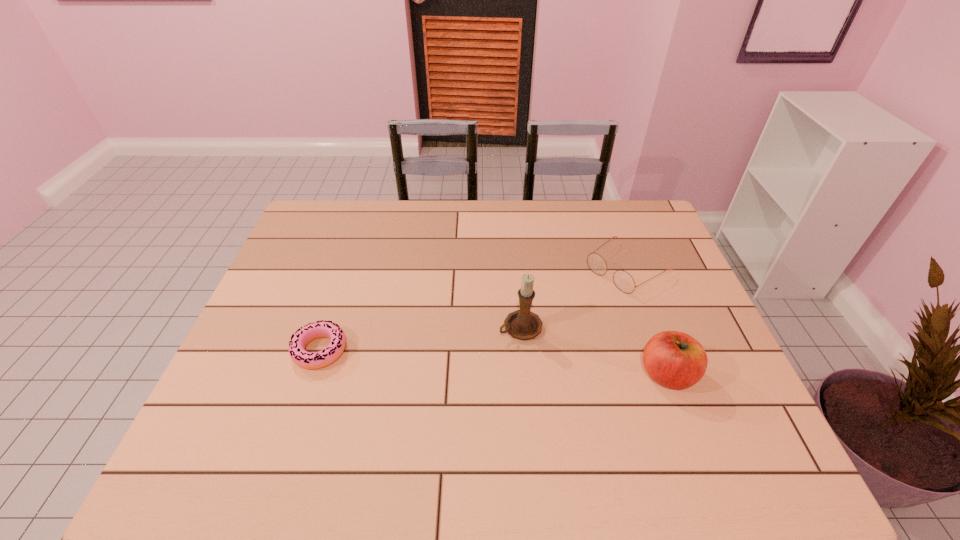
Identify the location of blank area located on the temples of the spectacles. The width and height of the screenshot is (960, 540). (567, 309).

This screenshot has width=960, height=540. What are the coordinates of `free space located on the temples of the spectacles` in the screenshot? It's located at (567, 309).

I want to click on vacant space situated on the side of the second object from left to right with the handle, so click(485, 342).

You are a GUI agent. You are given a task and a screenshot of the screen. Output one action in this format:
    pyautogui.click(x=<x>, y=<y>)
    Task: Click on the blank space located on the side of the second object from left to right with the handle
    
    Given the screenshot: What is the action you would take?
    pyautogui.click(x=461, y=353)

Locate an element on the screen. free region located 0.160m on the side of the second object from left to right with the handle is located at coordinates coord(446,359).

Find the location of a particular element. The height and width of the screenshot is (540, 960). object located in the near edge section of the desktop is located at coordinates (674, 359).

The height and width of the screenshot is (540, 960). What are the coordinates of `object positioned at the left edge` in the screenshot? It's located at (309, 360).

Locate an element on the screen. This screenshot has height=540, width=960. apple that is at the right edge is located at coordinates (674, 359).

Where is `spectacles positioned at the right edge`? The width and height of the screenshot is (960, 540). spectacles positioned at the right edge is located at coordinates tap(624, 282).

The width and height of the screenshot is (960, 540). What are the coordinates of `object that is at the near right corner` in the screenshot? It's located at (674, 359).